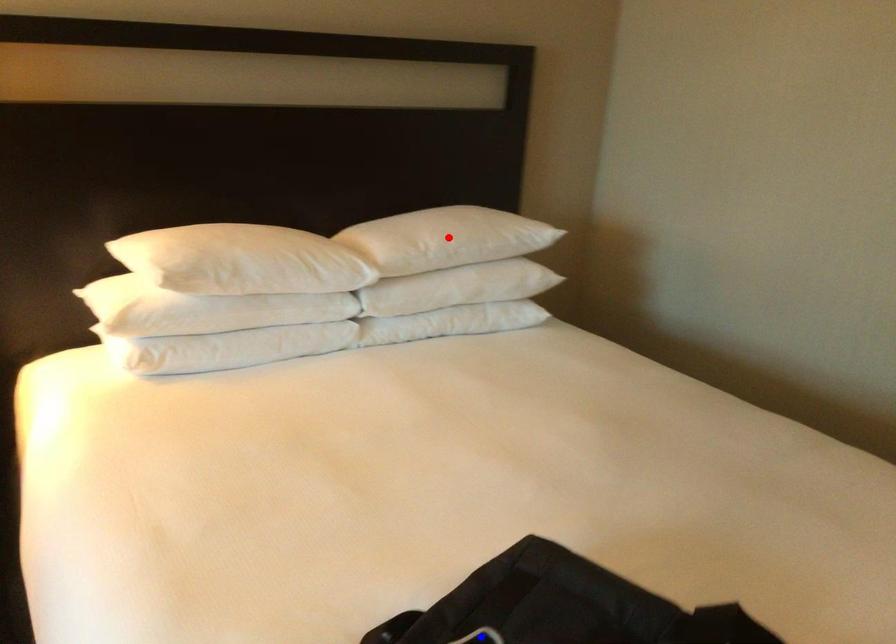
Question: In the image, two points are highlighted. Which point is nearer to the camera? Reply with the corresponding letter.

Choices:
 (A) blue point
 (B) red point

Answer: (A)